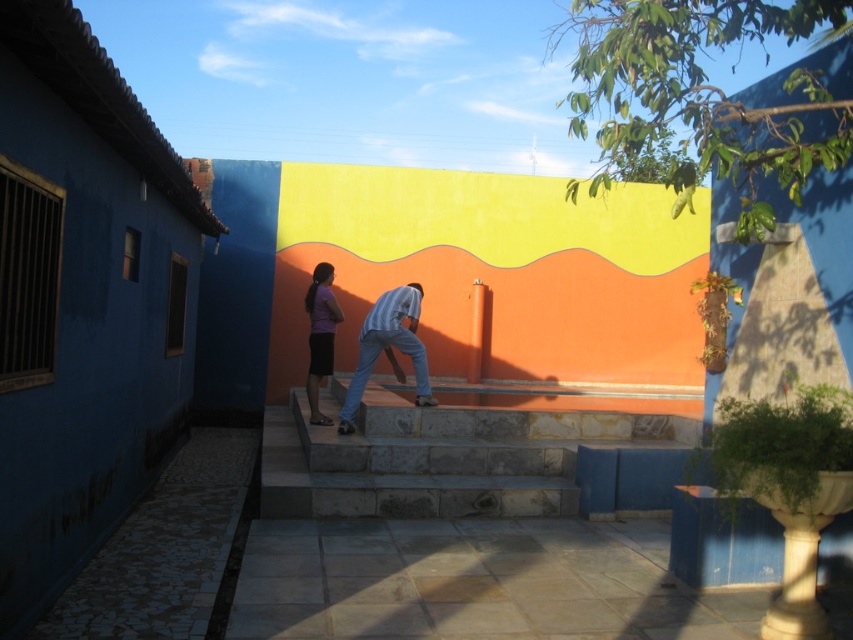
Question: Does light blue jeans at center appear over purple matte skirt at center?

Choices:
 (A) no
 (B) yes

Answer: (A)

Question: Is natural stone stairs at center wider than purple matte skirt at center?

Choices:
 (A) yes
 (B) no

Answer: (A)

Question: Considering the real-world distances, which object is farthest from the purple matte skirt at center?

Choices:
 (A) light blue jeans at center
 (B) natural stone stairs at center

Answer: (B)

Question: Which point is farther to the camera?

Choices:
 (A) natural stone stairs at center
 (B) light blue jeans at center
 (C) purple matte skirt at center

Answer: (C)

Question: Is natural stone stairs at center further to the viewer compared to purple matte skirt at center?

Choices:
 (A) no
 (B) yes

Answer: (A)

Question: Which point appears closest to the camera in this image?

Choices:
 (A) (318, 268)
 (B) (413, 330)

Answer: (A)